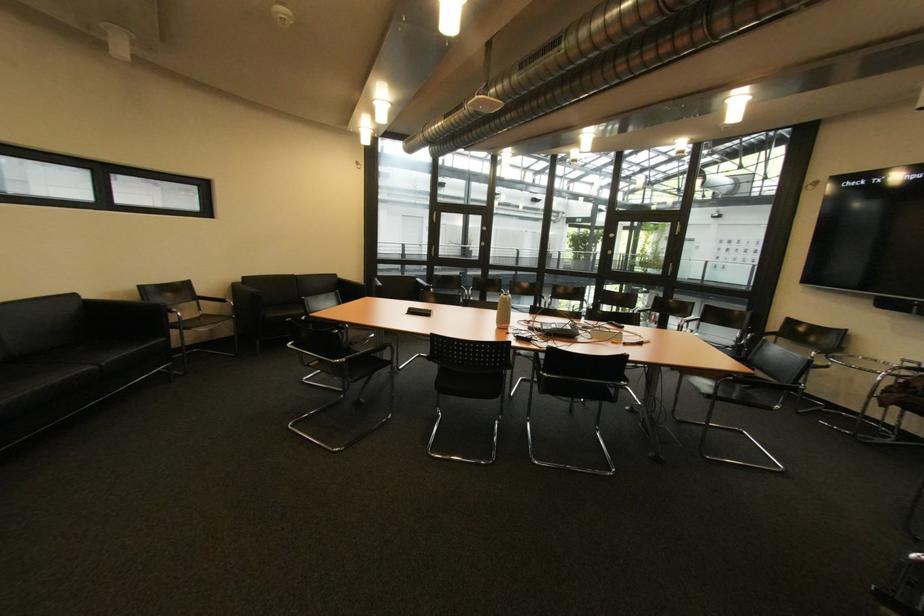
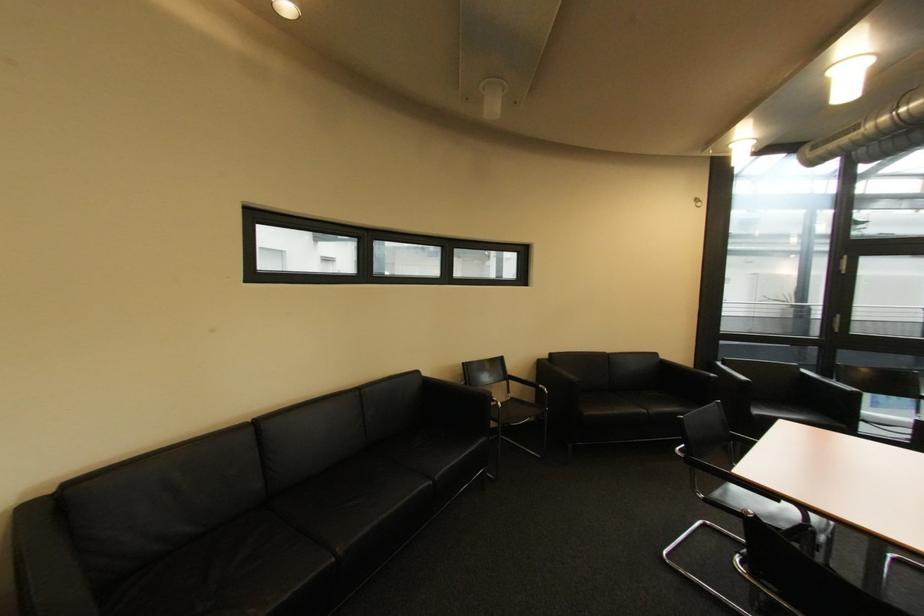
Locate, in the second image, the point that corresponds to pixel 213 317 in the first image.

(520, 400)